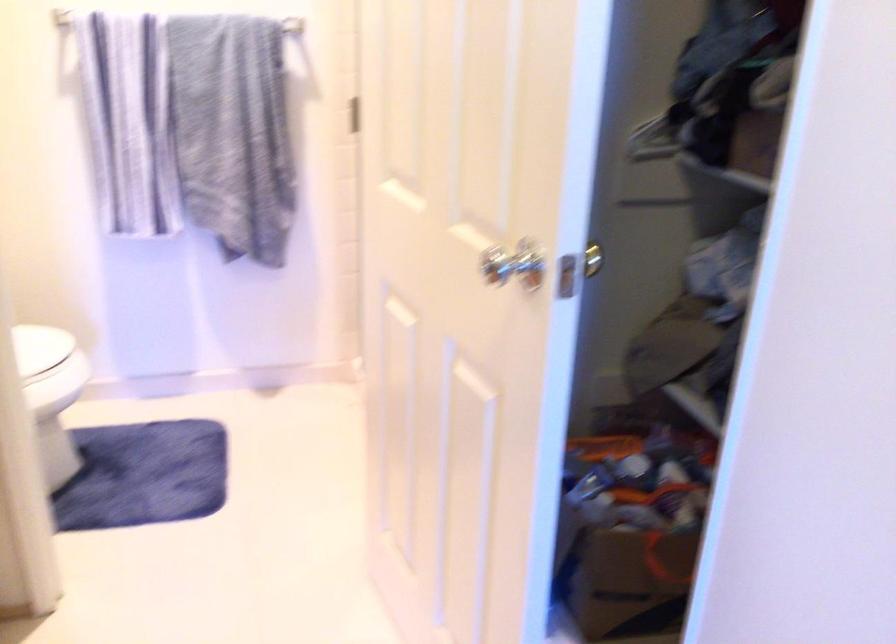
Image resolution: width=896 pixels, height=644 pixels. Describe the element at coordinates (513, 265) in the screenshot. I see `a chrome door knob` at that location.